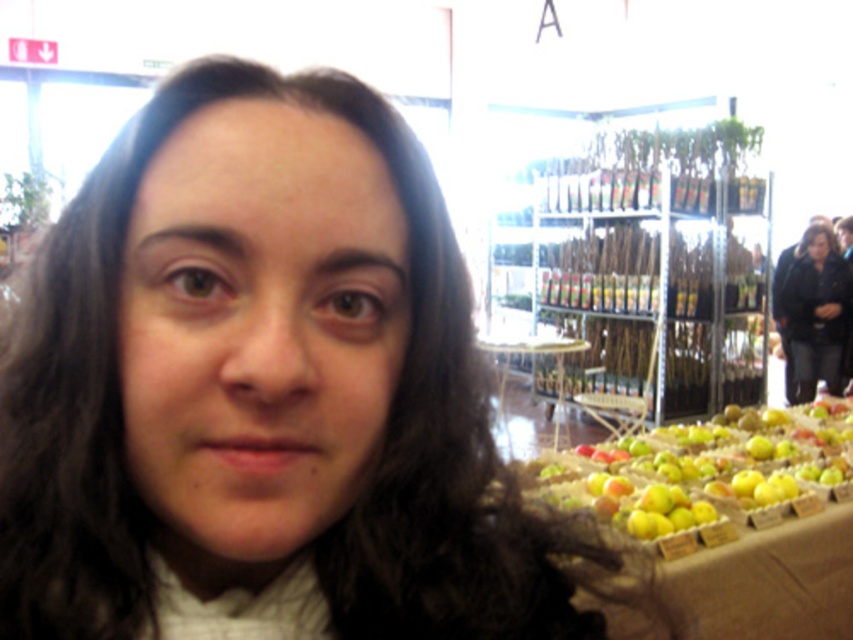
You are a customer at the market and want to place a large basket on the clear glass table at center. However, you notice the green matte apples at lower right are already occupying space. Based on their sizes, will the apples prevent the basket from fitting on the table?

The green matte apples at lower right are wider than the clear glass table at center, so placing the basket might be challenging as the apples already occupy most of the table space.

You are a customer at a market and see the green matte apples at lower right and the clear glass table at center. Which object is located below the other?

The green matte apples at lower right are positioned under the clear glass table at center.

You are a customer at the market and want to pick up the green matte apples at lower right. Can you reach them without moving the clear glass table at center?

The green matte apples at lower right is in front of clear glass table at center, so you can reach them without moving the table since they are already positioned in front of it.